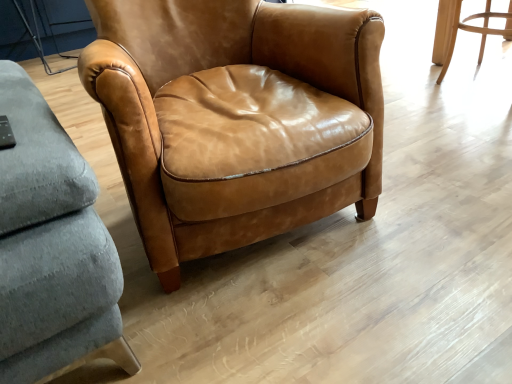
This screenshot has width=512, height=384. In order to click on vacant area that is situated to the right of matte leather chair at center, the second chair in the right-to-left sequence in this screenshot , I will do `click(438, 172)`.